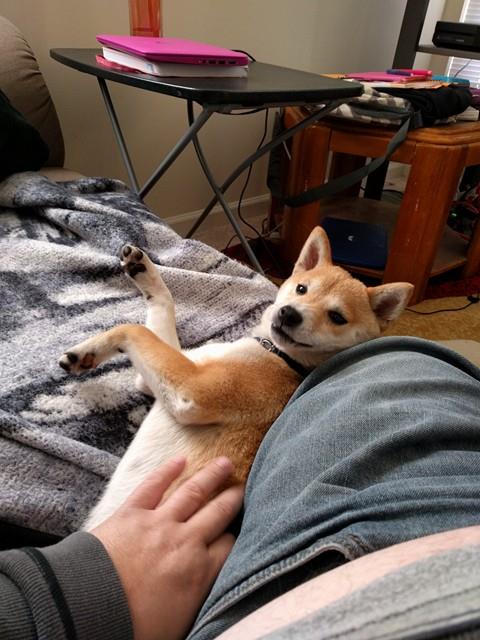
Find the location of `empty space on wall`. empty space on wall is located at coordinates (247, 22).